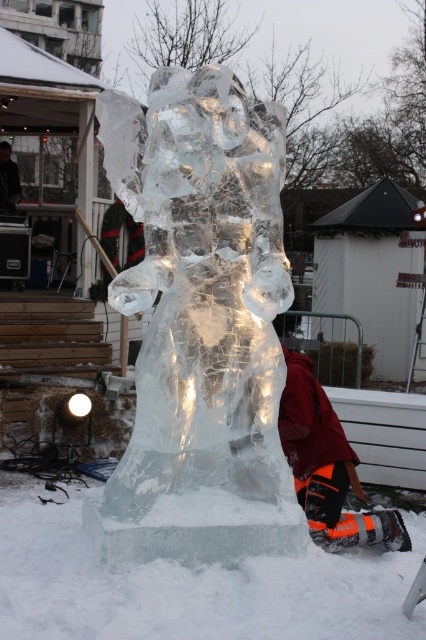
Question: Is clear ice sculpture at center further to the viewer compared to orange snow pants at lower right?

Choices:
 (A) yes
 (B) no

Answer: (B)

Question: Which point is closer to the camera?

Choices:
 (A) (147, 138)
 (B) (330, 508)

Answer: (A)

Question: Is clear ice sculpture at center behind orange snow pants at lower right?

Choices:
 (A) no
 (B) yes

Answer: (A)

Question: Considering the relative positions of clear ice sculpture at center and orange snow pants at lower right in the image provided, where is clear ice sculpture at center located with respect to orange snow pants at lower right?

Choices:
 (A) left
 (B) right

Answer: (A)